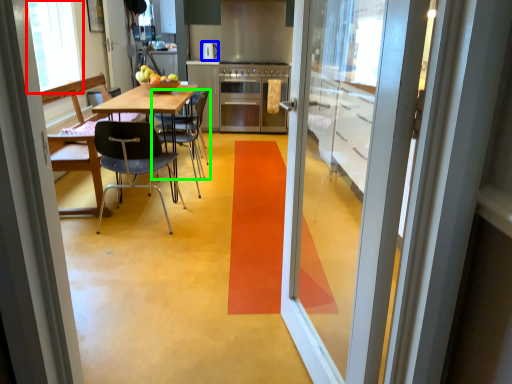
Question: Considering the real-world distances, which object is farthest from window screen (highlighted by a red box)? appliance (highlighted by a blue box) or chair (highlighted by a green box)?

Choices:
 (A) appliance
 (B) chair

Answer: (A)